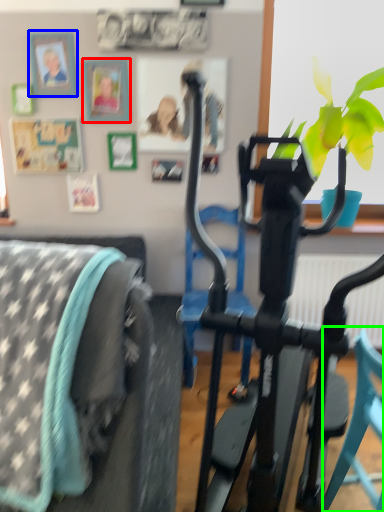
Question: Which is nearer to the picture frame (highlighted by a red box)? picture frame (highlighted by a blue box) or chair (highlighted by a green box).

Choices:
 (A) picture frame
 (B) chair

Answer: (A)